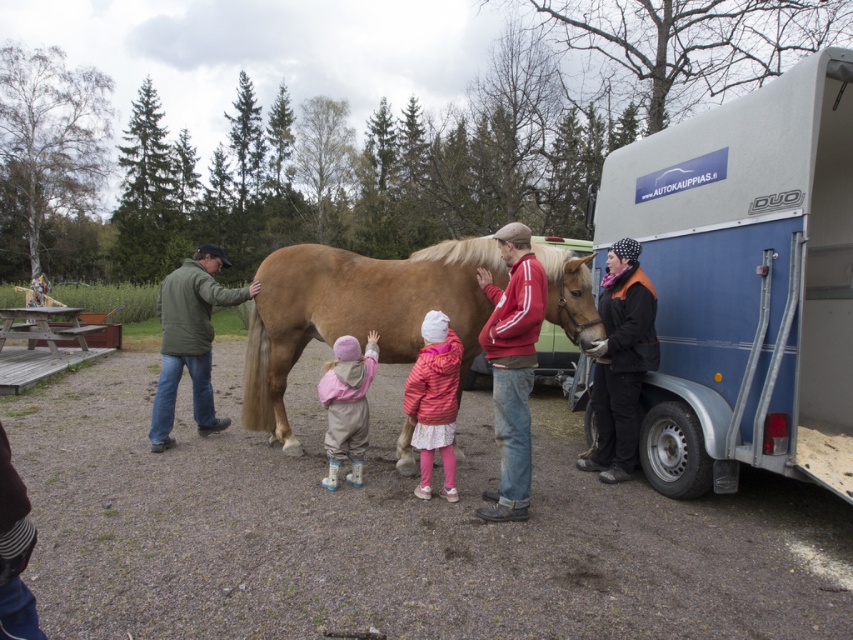
Question: Which is farther from the golden brown fur at center?

Choices:
 (A) blue metallic camper at right
 (B) red fleece jacket at center
 (C) black fleece jacket at right
 (D) green matte jacket at left

Answer: (A)

Question: Is golden brown fur at center closer to the viewer compared to black fleece jacket at right?

Choices:
 (A) yes
 (B) no

Answer: (A)

Question: Which point is closer to the camera?

Choices:
 (A) (697, 285)
 (B) (345, 339)
 (C) (503, 492)

Answer: (C)

Question: Can you confirm if red fleece jacket at center is positioned to the right of green matte jacket at left?

Choices:
 (A) yes
 (B) no

Answer: (A)

Question: Can you confirm if golden brown fur at center is positioned to the right of green matte jacket at left?

Choices:
 (A) no
 (B) yes

Answer: (B)

Question: Among these points, which one is farthest from the camera?

Choices:
 (A) (357, 483)
 (B) (175, 330)
 (C) (648, 282)
 (D) (788, 324)

Answer: (B)